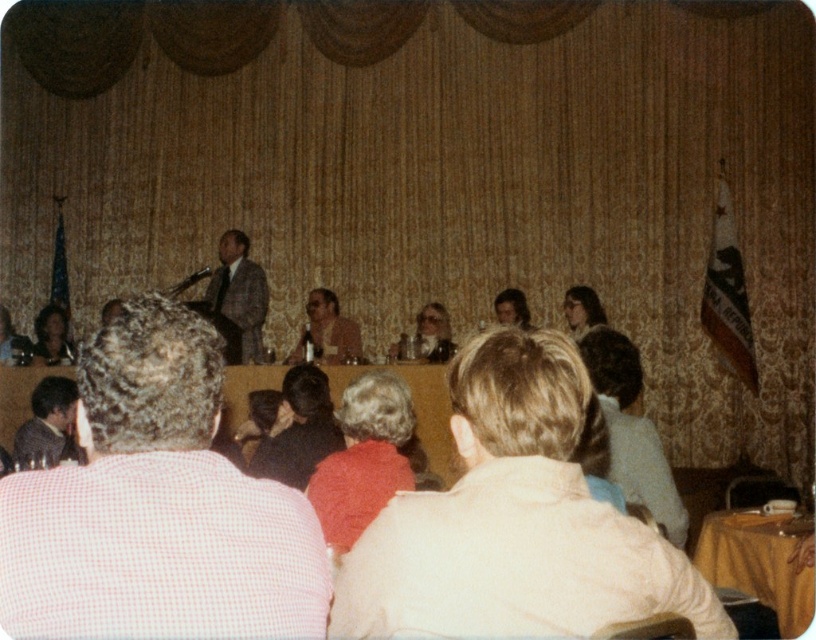
You are an event organizer standing at the stage. You notice a participant wearing a red wool sweater at center and another with blonde hair at center. If you want to invite both to join the panel, which one would you need to gesture to first to ensure they see you?

The blonde hair at center is closer to the stage than the red wool sweater at center, so you should gesture to the blonde hair at center first to ensure they see you.

You are an event planner standing at the back of the room. You notice the red wool sweater at center and the blonde hair at center. Which one is closer to you?

The red wool sweater at center is closer to you because it is in front of the blonde hair at center.